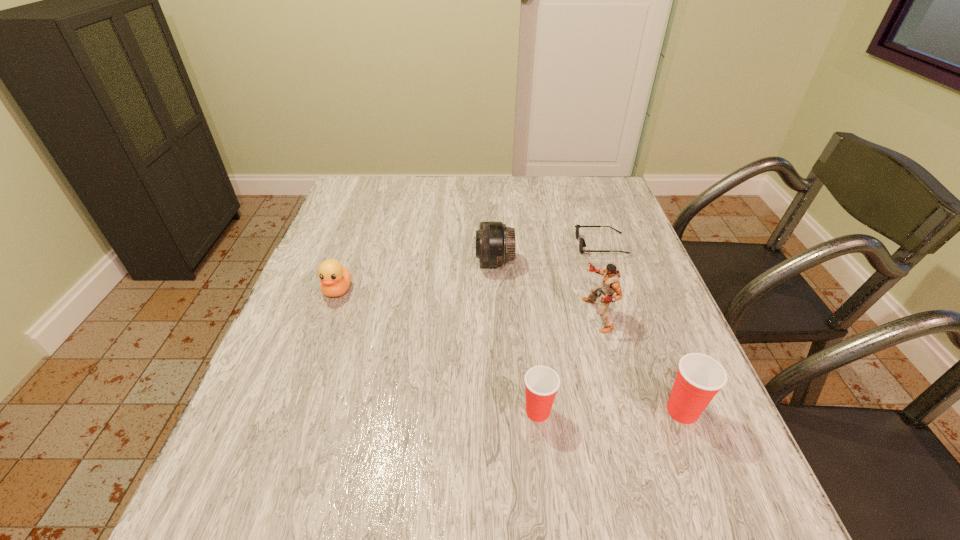
At what (x,y) coordinates should I click in order to perform the action: click on free region that satisfies the following two spatial constraints: 1. on the front-facing side of the shortest object; 2. on the front side of the shorter Dixie cup. Please return your answer as a coordinate pair (x, y). Looking at the image, I should click on (659, 411).

Where is `vacant region that satisfies the following two spatial constraints: 1. on the front-facing side of the telephoto lens; 2. on the face of the leftmost object`? Image resolution: width=960 pixels, height=540 pixels. vacant region that satisfies the following two spatial constraints: 1. on the front-facing side of the telephoto lens; 2. on the face of the leftmost object is located at coordinates (495, 290).

What are the coordinates of `vacant position in the image that satisfies the following two spatial constraints: 1. on the front-facing side of the right Dixie cup; 2. on the right side of the puncher` in the screenshot? It's located at (623, 411).

Where is `free location that satisfies the following two spatial constraints: 1. on the front-facing side of the telephoto lens; 2. on the left side of the shorter Dixie cup`? free location that satisfies the following two spatial constraints: 1. on the front-facing side of the telephoto lens; 2. on the left side of the shorter Dixie cup is located at coordinates click(500, 411).

Locate an element on the screen. The height and width of the screenshot is (540, 960). free location that satisfies the following two spatial constraints: 1. on the front-facing side of the right Dixie cup; 2. on the left side of the shortest object is located at coordinates (659, 411).

Image resolution: width=960 pixels, height=540 pixels. Identify the location of free space that satisfies the following two spatial constraints: 1. on the front-facing side of the right Dixie cup; 2. on the right side of the telephoto lens. (500, 411).

Where is `vacant area that satisfies the following two spatial constraints: 1. on the front-facing side of the shortest object; 2. on the face of the duckling`? The height and width of the screenshot is (540, 960). vacant area that satisfies the following two spatial constraints: 1. on the front-facing side of the shortest object; 2. on the face of the duckling is located at coordinates (617, 290).